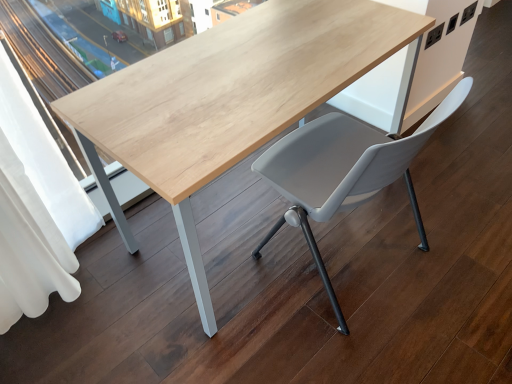
Question: From the image's perspective, relative to natural wood table at center, is white fabric curtain at left above or below?

Choices:
 (A) above
 (B) below

Answer: (B)

Question: Based on their positions, is white fabric curtain at left located to the left or right of natural wood table at center?

Choices:
 (A) right
 (B) left

Answer: (B)

Question: Based on their relative distances, which object is nearer to the matte gray plastic chair at center?

Choices:
 (A) natural wood table at center
 (B) white fabric curtain at left

Answer: (A)

Question: Which object is the closest to the matte gray plastic chair at center?

Choices:
 (A) white fabric curtain at left
 (B) natural wood table at center

Answer: (B)